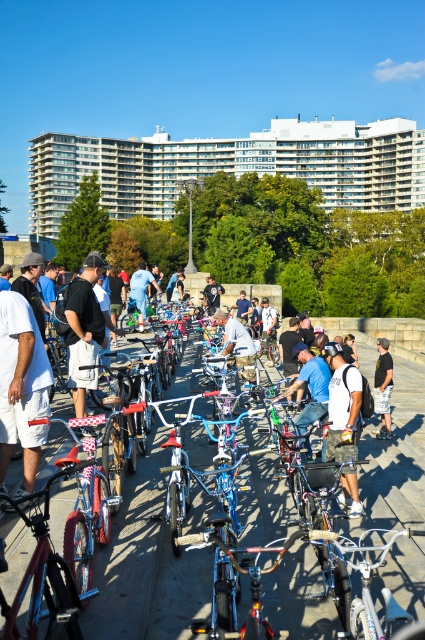
You are standing at the point labeled as point (84, 330) in the image. Looking around, you see a group of people and bicycles. What is the color of the clothing item directly beneath you?

The point (84, 330) is on the matte black shirt at center, so the clothing item directly beneath you is matte black.

You are standing at the point with coordinates point (144, 280) and want to walk to the point with coordinates point (237, 349). According to the scene description, which direction should you move to reach your destination?

You should move forward because point (237, 349) is in front of point (144, 280).

You are standing in the middle of the scene and notice both the concrete pavement at center and the matte black shirt at center. Which object is positioned lower relative to the other?

The concrete pavement at center is positioned below the matte black shirt at center, so it is lower.